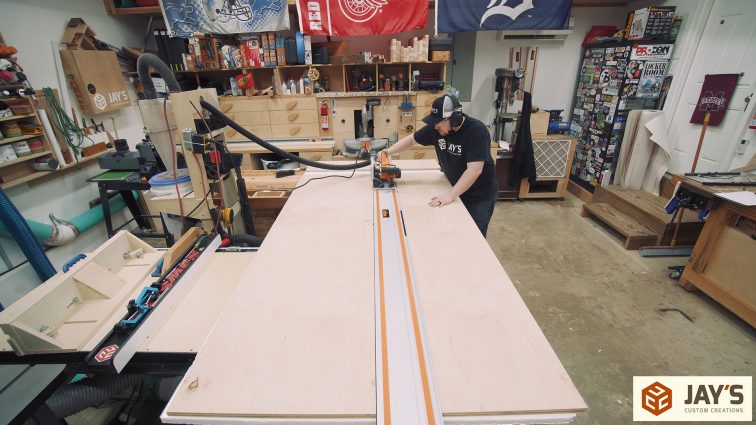
Where is `stairs`? The width and height of the screenshot is (756, 425). stairs is located at coordinates (608, 206), (637, 207).